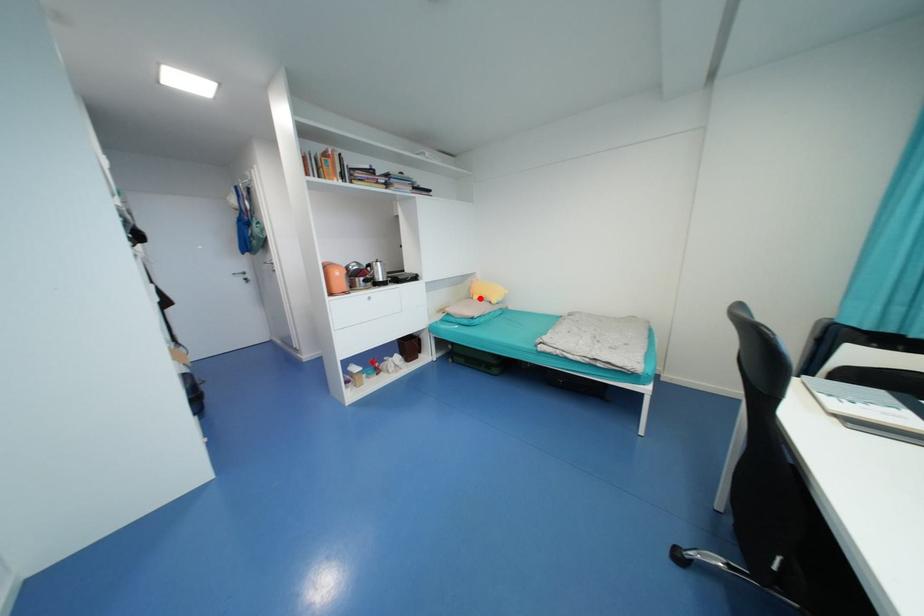
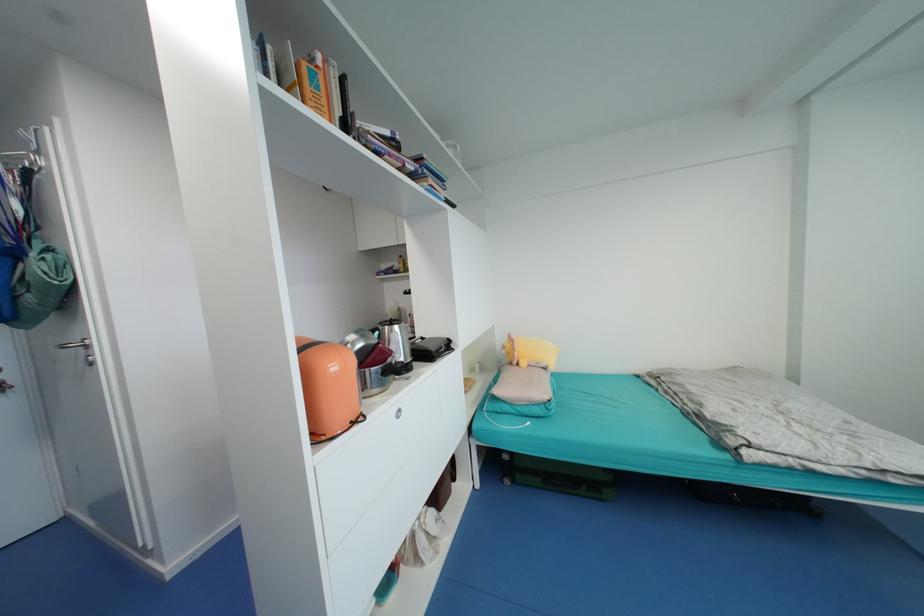
The point at the highlighted location is marked in the first image. Where is the corresponding point in the second image?

(529, 365)